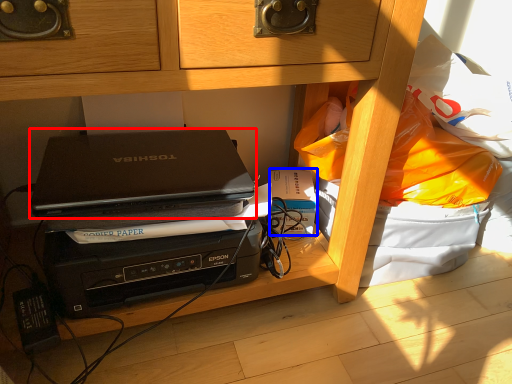
Question: Among these objects, which one is nearest to the camera, laptop (highlighted by a red box) or paperback book (highlighted by a blue box)?

Choices:
 (A) laptop
 (B) paperback book

Answer: (A)